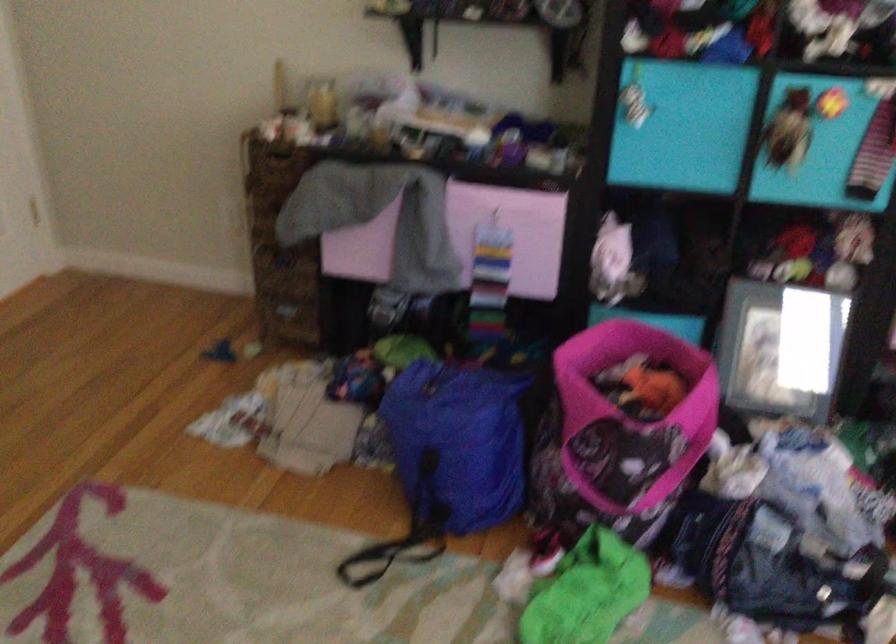
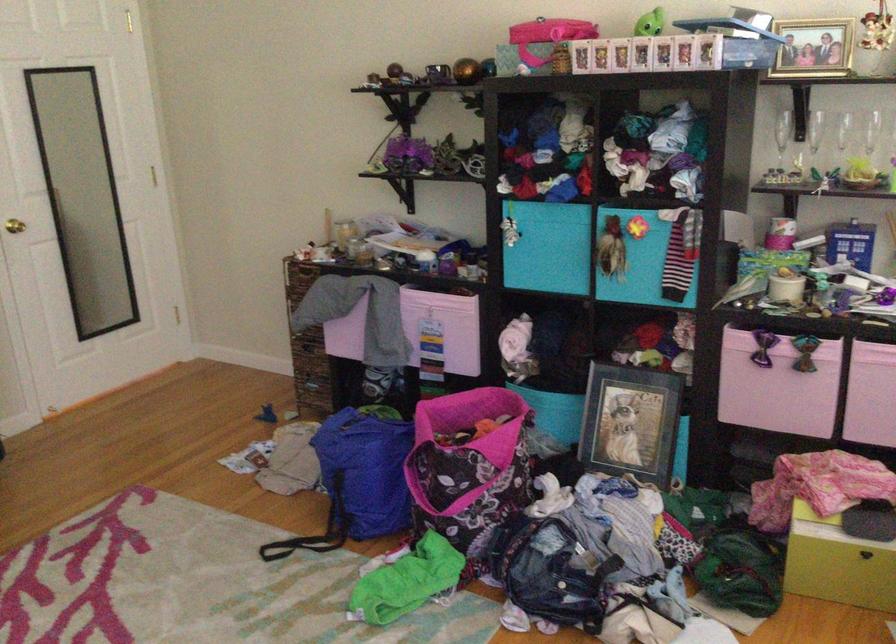
The point at [782,348] is marked in the first image. Where is the corresponding point in the second image?

(631, 422)